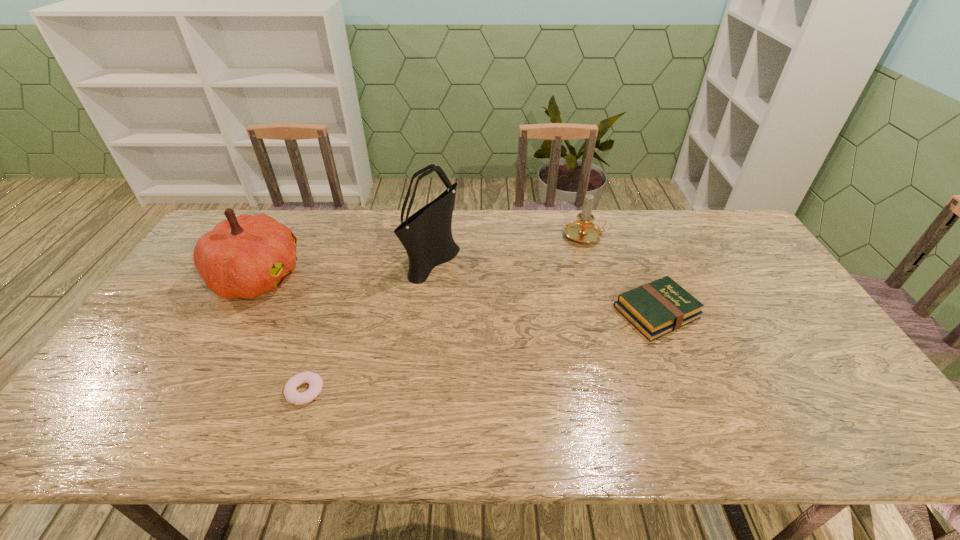
Where is `vacant space at the left edge of the desktop`? vacant space at the left edge of the desktop is located at coordinates (125, 381).

Locate an element on the screen. vacant space at the far left corner of the desktop is located at coordinates (251, 214).

The width and height of the screenshot is (960, 540). I want to click on free space between the tallest object and the leftmost object, so click(x=346, y=268).

Locate an element on the screen. This screenshot has width=960, height=540. blank region between the fourth shortest object and the shortest object is located at coordinates (281, 334).

Where is `free area in between the candle and the nearest object`? This screenshot has height=540, width=960. free area in between the candle and the nearest object is located at coordinates (445, 313).

I want to click on free space that is in between the fourth tallest object and the candle, so click(x=621, y=274).

Locate an element on the screen. This screenshot has height=540, width=960. unoccupied area between the fourth shortest object and the fourth object from right to left is located at coordinates (281, 334).

Image resolution: width=960 pixels, height=540 pixels. In order to click on empty space that is in between the tallest object and the fourth object from right to left in this screenshot , I will do `click(369, 325)`.

The width and height of the screenshot is (960, 540). In order to click on vacant point located between the shoulder bag and the candle in this screenshot , I will do `click(510, 248)`.

In order to click on blank region between the second object from left to right and the third object from left to right in this screenshot , I will do pyautogui.click(x=369, y=325).